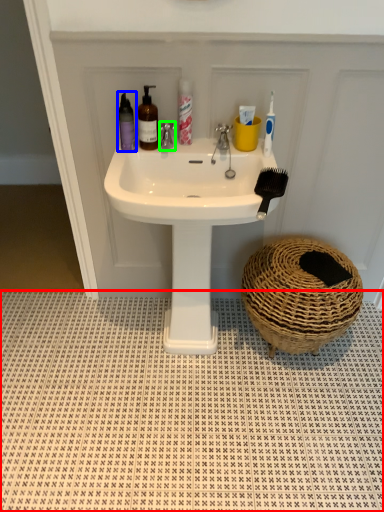
Question: Based on their relative distances, which object is nearer to tile (highlighted by a red box)? Choose from mouthwash (highlighted by a blue box) and tap (highlighted by a green box).

Choices:
 (A) mouthwash
 (B) tap

Answer: (A)